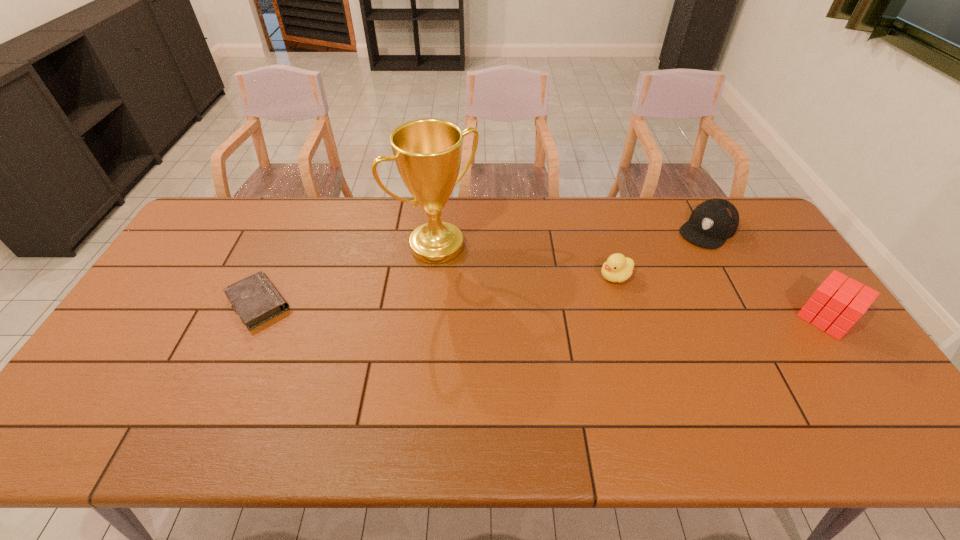
The height and width of the screenshot is (540, 960). I want to click on the leftmost object, so click(x=255, y=299).

Where is `the shortest object`? The image size is (960, 540). the shortest object is located at coordinates (255, 299).

At what (x,y) coordinates should I click in order to perform the action: click on cube. Please return your answer as a coordinate pair (x, y). This screenshot has width=960, height=540. Looking at the image, I should click on (842, 306).

Locate an element on the screen. cap is located at coordinates (712, 222).

In order to click on the tallest object in this screenshot , I will do `click(427, 152)`.

Find the location of a particular element. The image size is (960, 540). the second object from left to right is located at coordinates (427, 152).

You are a GUI agent. You are given a task and a screenshot of the screen. Output one action in this format:
    pyautogui.click(x=<x>, y=<y>)
    Task: Click on the third object from left to right
    The width and height of the screenshot is (960, 540).
    Given the screenshot: What is the action you would take?
    pyautogui.click(x=617, y=268)

Identify the location of free space located 0.320m on the back of the leftmost object. (300, 212).

The height and width of the screenshot is (540, 960). Find the location of `free region located on the left of the cube`. free region located on the left of the cube is located at coordinates (715, 318).

Where is `free space located 0.350m on the front-facing side of the second object from right to left`? This screenshot has width=960, height=540. free space located 0.350m on the front-facing side of the second object from right to left is located at coordinates [631, 298].